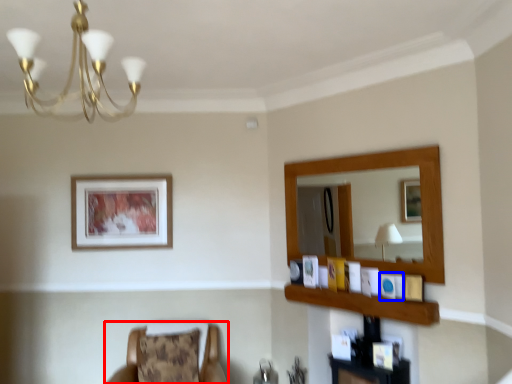
Question: Which of the following is the closest to the observer, chair (highlighted by a red box) or picture frame (highlighted by a blue box)?

Choices:
 (A) chair
 (B) picture frame

Answer: (A)